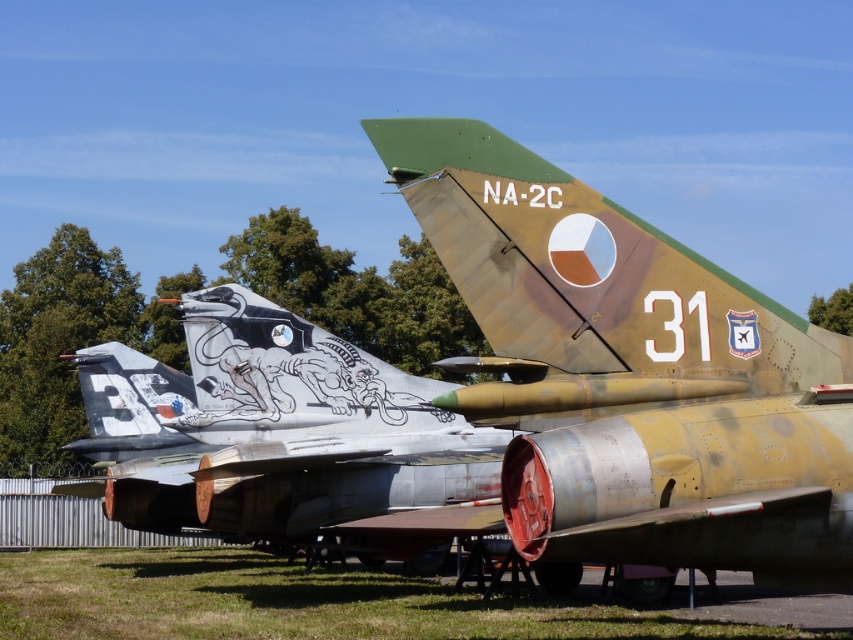
You are a pilot standing at the entrance of the airfield. You see the camouflage paint airplane at center. Can you determine if the camouflage paint airplane at center is located at point (630, 374)?

Yes, the camouflage paint airplane at center is located at point (630, 374) as stated in the description.

Based on the scene description, where is the silver metallic aircraft at center located in terms of coordinates?

The silver metallic aircraft at center is located at coordinates point (271, 428).